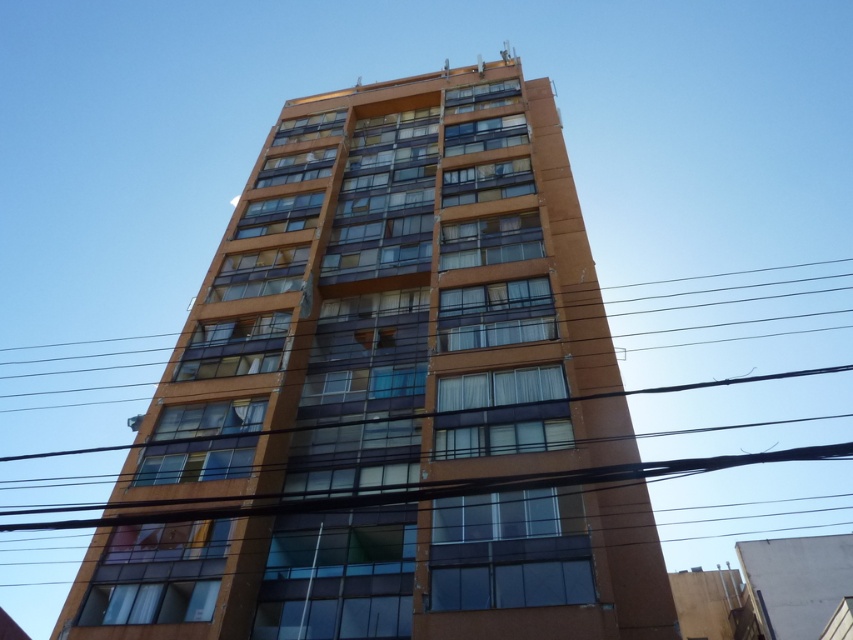
Question: Is orange glass building at center positioned behind transparent glass power lines at center?

Choices:
 (A) yes
 (B) no

Answer: (B)

Question: Which point is farther to the camera?

Choices:
 (A) transparent glass power lines at center
 (B) orange glass building at center

Answer: (A)

Question: Can you confirm if orange glass building at center is wider than transparent glass power lines at center?

Choices:
 (A) no
 (B) yes

Answer: (A)

Question: Does orange glass building at center come in front of transparent glass power lines at center?

Choices:
 (A) no
 (B) yes

Answer: (B)